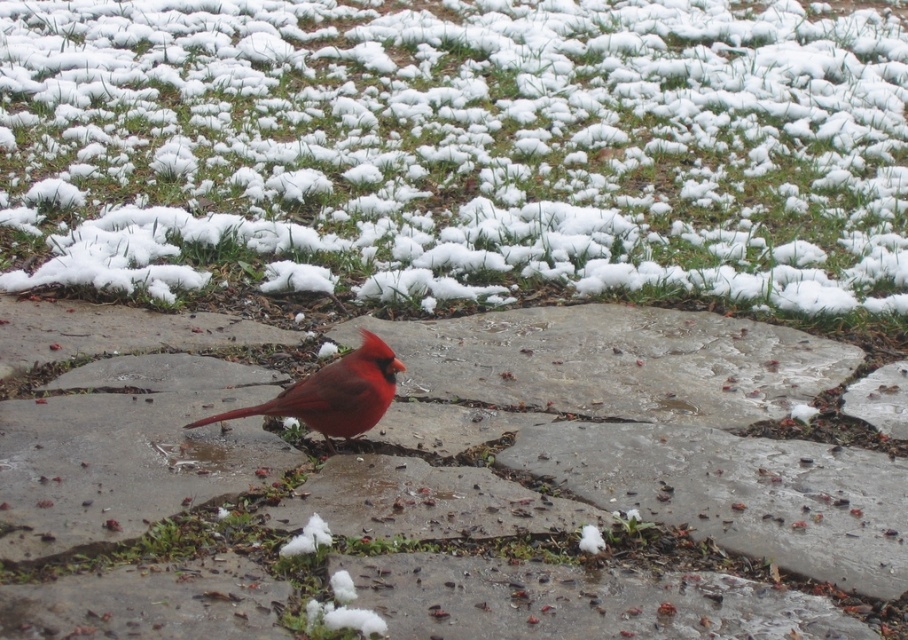
Measure the distance between point (834, 556) and camera.

A distance of 9.06 feet exists between point (834, 556) and camera.

Which is above, smooth concrete at center or matte red bird at center?

matte red bird at center is above.

Image resolution: width=908 pixels, height=640 pixels. Describe the element at coordinates (476, 461) in the screenshot. I see `smooth concrete at center` at that location.

Identify the location of smooth concrete at center. This screenshot has width=908, height=640. click(476, 461).

Does white fluffy grass at upper center lie in front of matte red bird at center?

No, it is behind matte red bird at center.

Which is in front, point (275, 268) or point (303, 394)?

Positioned in front is point (303, 394).

Locate an element on the screen. Image resolution: width=908 pixels, height=640 pixels. white fluffy grass at upper center is located at coordinates (459, 150).

Based on the photo, which is above, white fluffy grass at upper center or smooth concrete at center?

white fluffy grass at upper center is above.

The width and height of the screenshot is (908, 640). I want to click on white fluffy grass at upper center, so click(459, 150).

Is point (402, 170) less distant than point (391, 464)?

No, (402, 170) is behind (391, 464).

The width and height of the screenshot is (908, 640). I want to click on white fluffy grass at upper center, so click(x=459, y=150).